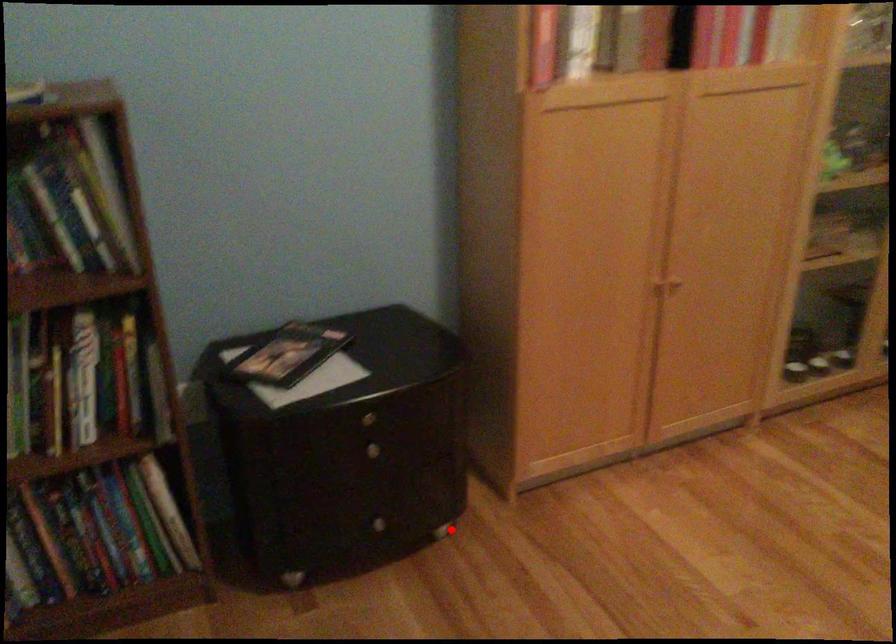
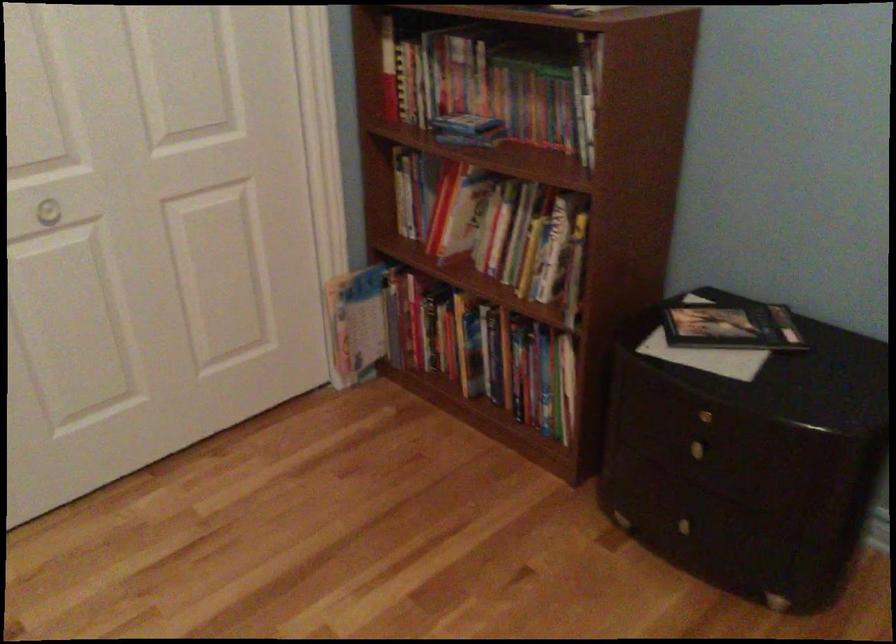
Question: I am providing you with two images of the same scene from different viewpoints. Given a red point in image1, look at the same physical point in image2. Is it:

Choices:
 (A) Closer to the viewpoint
 (B) Farther from the viewpoint

Answer: (A)